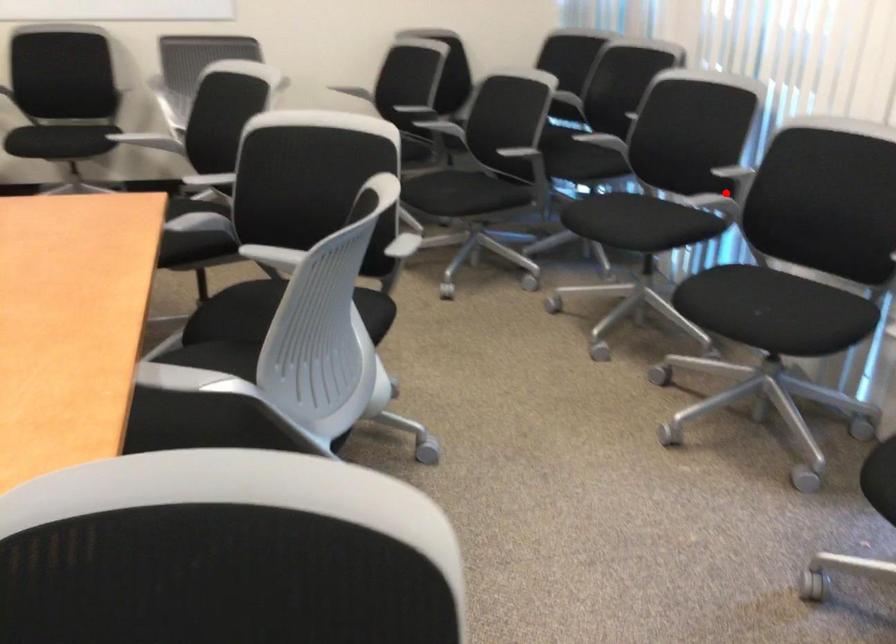
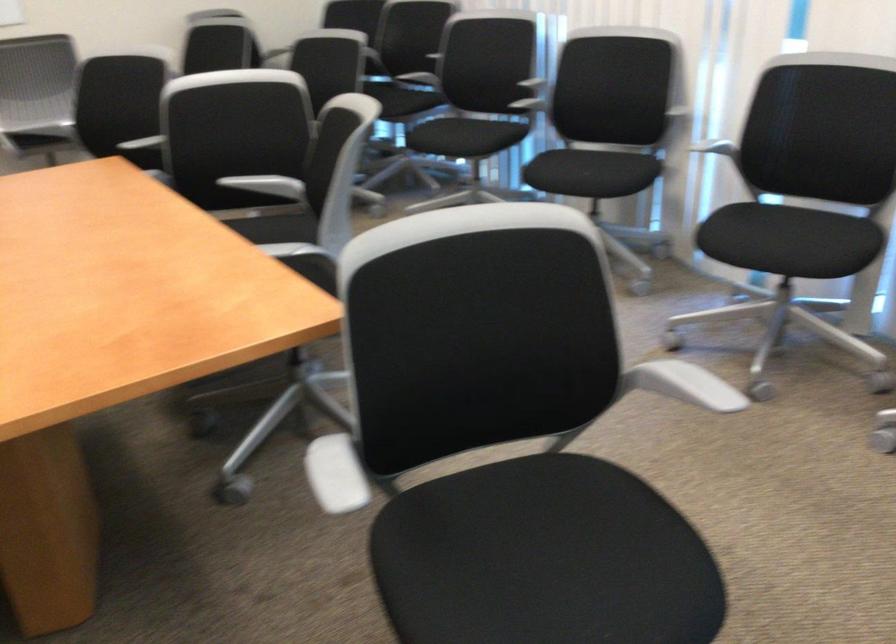
Question: I am providing you with two images of the same scene from different viewpoints. A red point is marked on the first image. At the location where the point appears in image 1, is it still visible in image 2?

Choices:
 (A) Yes
 (B) No

Answer: (B)